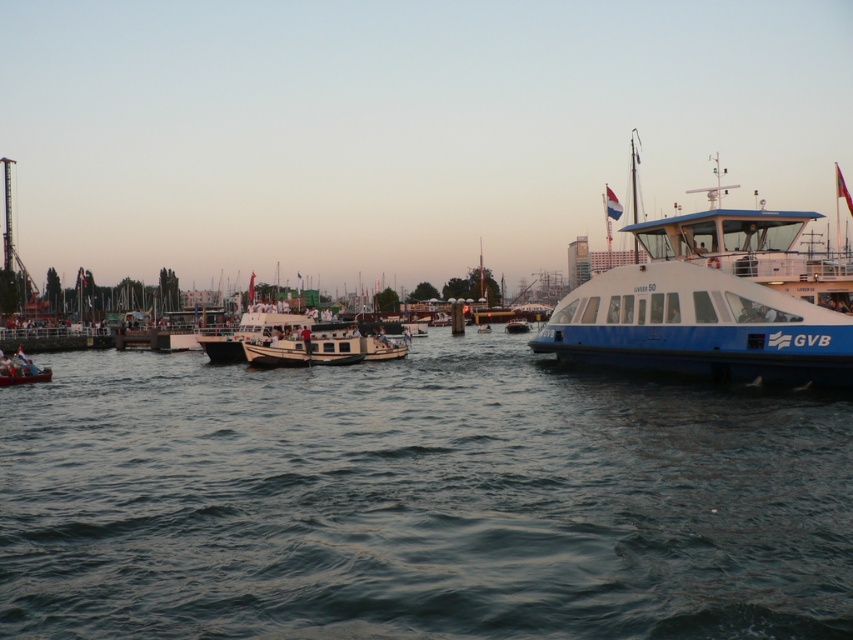
Can you confirm if dark blue water at center is positioned to the right of white glossy boat at center?

In fact, dark blue water at center is to the left of white glossy boat at center.

Does dark blue water at center have a greater height compared to white glossy boat at center?

No, dark blue water at center is not taller than white glossy boat at center.

Is point (656, 380) less distant than point (515, 323)?

Yes, point (656, 380) is closer to viewer.

Identify the location of dark blue water at center. (418, 500).

Is dark blue water at center positioned behind blue glossy ferry at right?

That is False.

Is dark blue water at center bigger than blue glossy ferry at right?

Yes, dark blue water at center is bigger than blue glossy ferry at right.

Which is behind, point (67, 634) or point (627, 332)?

The point (627, 332) is more distant.

The height and width of the screenshot is (640, 853). Identify the location of dark blue water at center. (418, 500).

Looking at this image, can you confirm if dark blue water at center is shorter than wooden canoe at lower left?

Incorrect, dark blue water at center's height does not fall short of wooden canoe at lower left's.

The width and height of the screenshot is (853, 640). Find the location of `dark blue water at center`. dark blue water at center is located at coordinates (418, 500).